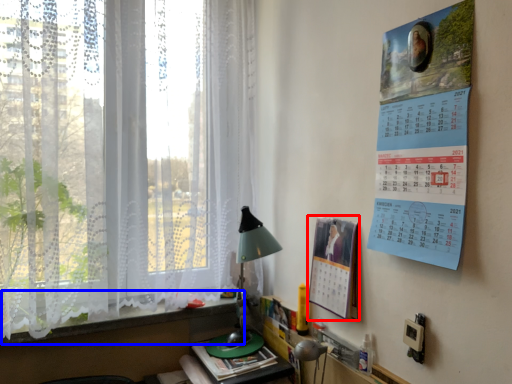
Question: Which point is closer to the camera, poster page (highlighted by a red box) or window sill (highlighted by a blue box)?

Choices:
 (A) poster page
 (B) window sill

Answer: (A)